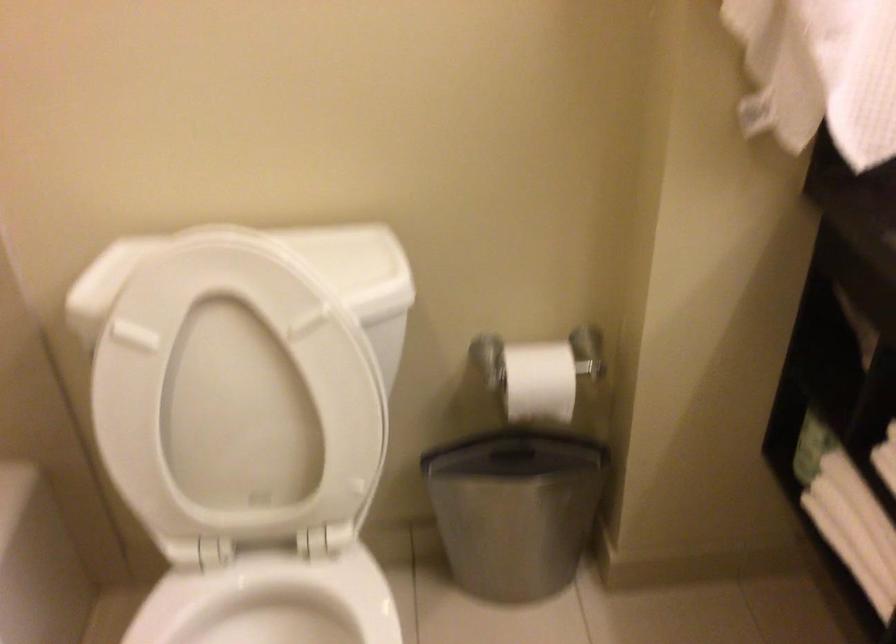
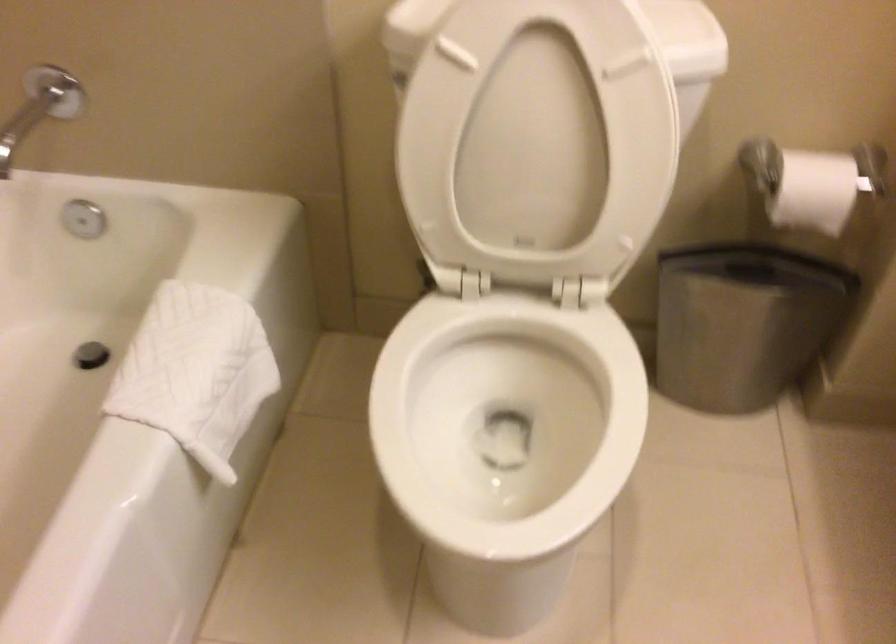
Locate, in the second image, the point that corresponds to point 536,383 in the first image.

(812, 183)